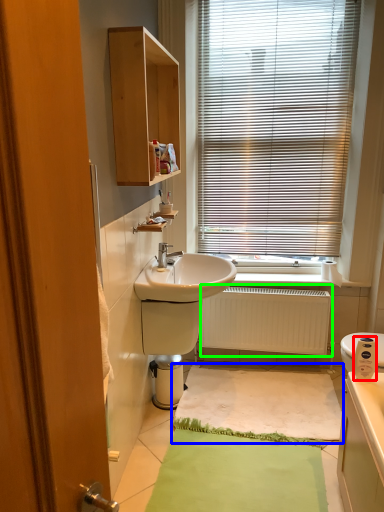
Question: Considering the real-world distances, which object is farthest from appliance (highlighted by a red box)? bath mat (highlighted by a blue box) or radiator (highlighted by a green box)?

Choices:
 (A) bath mat
 (B) radiator

Answer: (A)